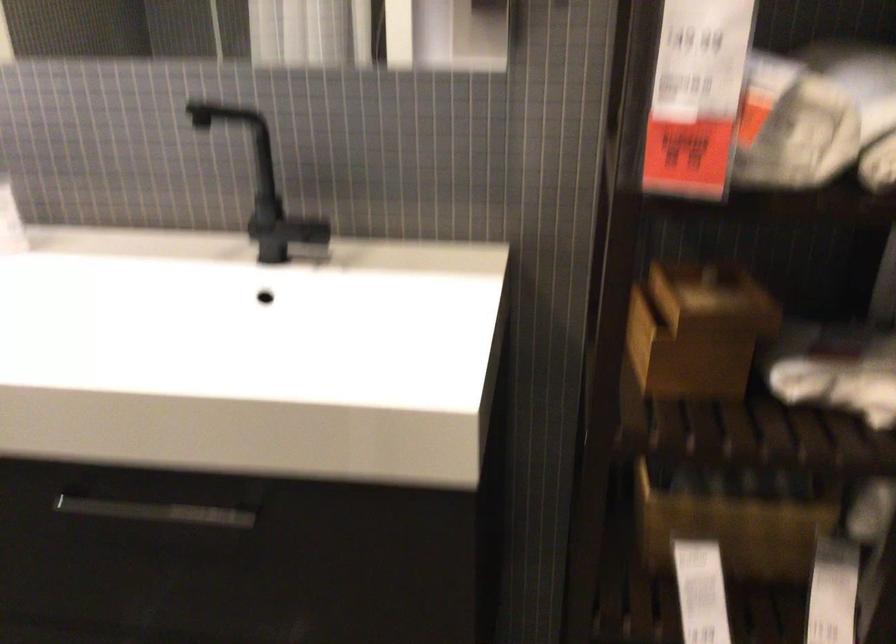
Where would you lift the black faucet handle? Please return your answer as a coordinate pair (x, y).

(268, 227)